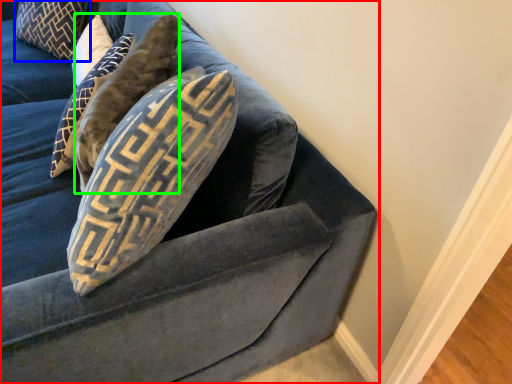
Question: Which object is positioned closest to studio couch (highlighted by a red box)? Select from pillow (highlighted by a blue box) and pillow (highlighted by a green box).

Choices:
 (A) pillow
 (B) pillow

Answer: (B)